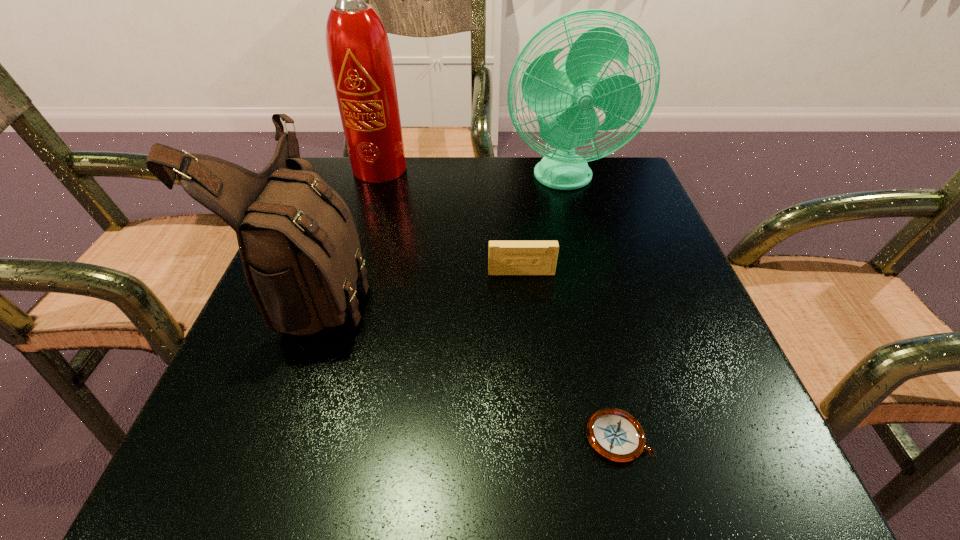
This screenshot has width=960, height=540. Find the location of `free space located 0.070m on the left of the shortest object`. free space located 0.070m on the left of the shortest object is located at coordinates (533, 437).

I want to click on fire extinguisher present at the far edge, so click(x=359, y=53).

Locate an element on the screen. fan that is at the far edge is located at coordinates (568, 94).

At what (x,y) coordinates should I click in order to perform the action: click on object that is at the near edge. Please return your answer as a coordinate pair (x, y). Image resolution: width=960 pixels, height=540 pixels. Looking at the image, I should click on (614, 434).

Find the location of a particular element. The height and width of the screenshot is (540, 960). fire extinguisher at the left edge is located at coordinates (359, 53).

Identify the location of shoulder bag present at the left edge. The height and width of the screenshot is (540, 960). (299, 246).

Image resolution: width=960 pixels, height=540 pixels. I want to click on fan that is at the right edge, so click(x=568, y=94).

Identify the location of compass at the right edge. Image resolution: width=960 pixels, height=540 pixels. (614, 434).

The image size is (960, 540). I want to click on object at the far left corner, so tap(359, 53).

What are the coordinates of `object that is at the far right corner` in the screenshot? It's located at (568, 94).